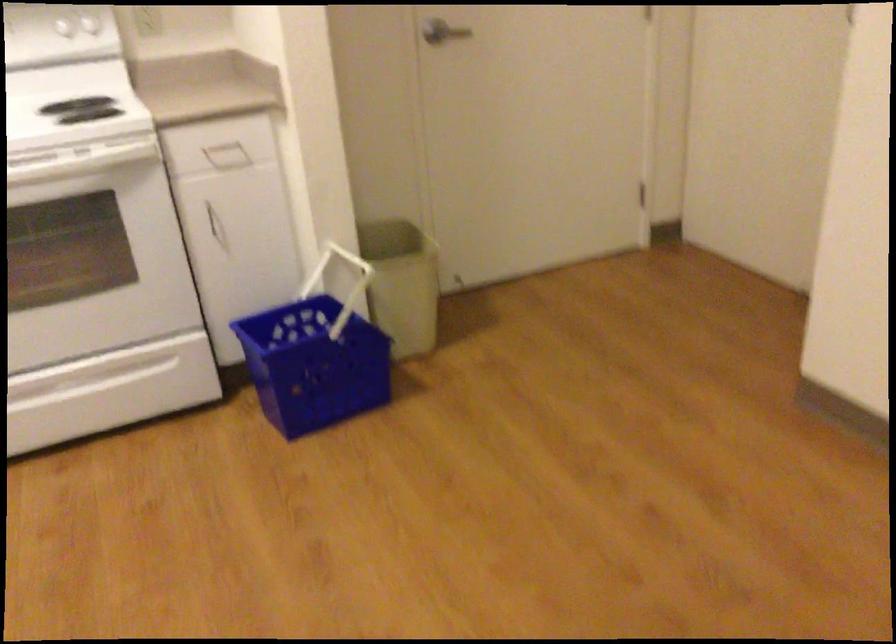
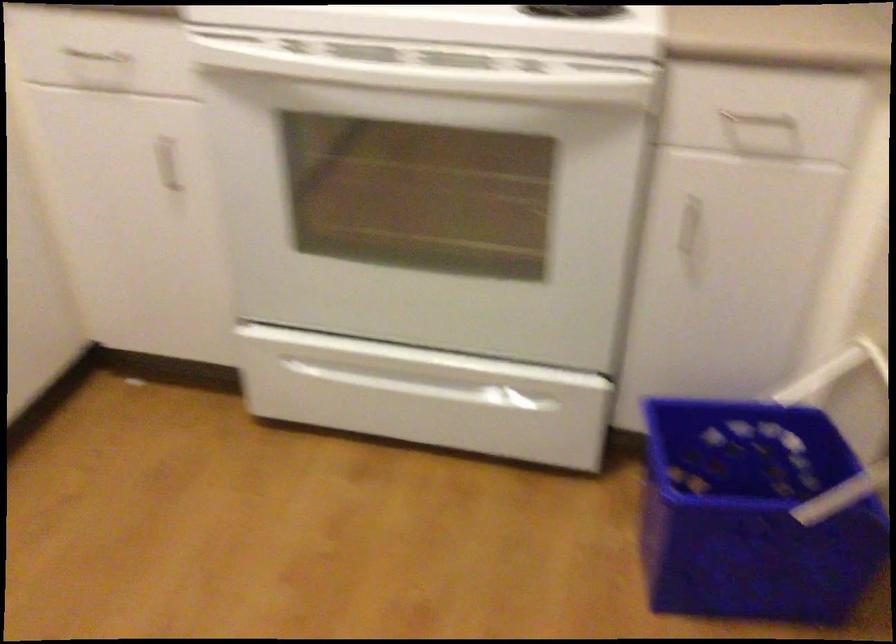
Find the pixel in the second image that matches point 214,219 in the first image.

(691, 228)